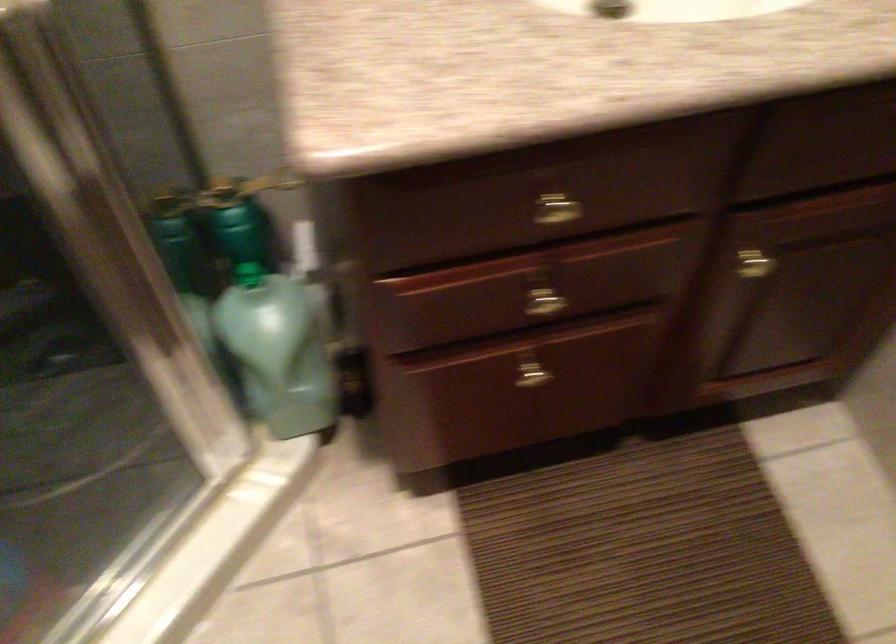
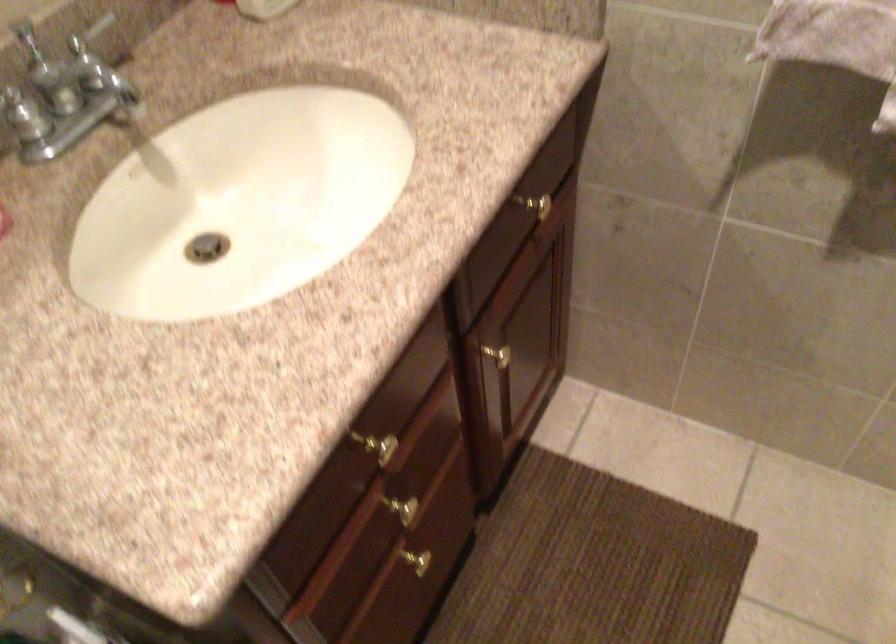
Question: How did the camera likely rotate?

Choices:
 (A) Left
 (B) Right
 (C) Up
 (D) Down

Answer: (B)